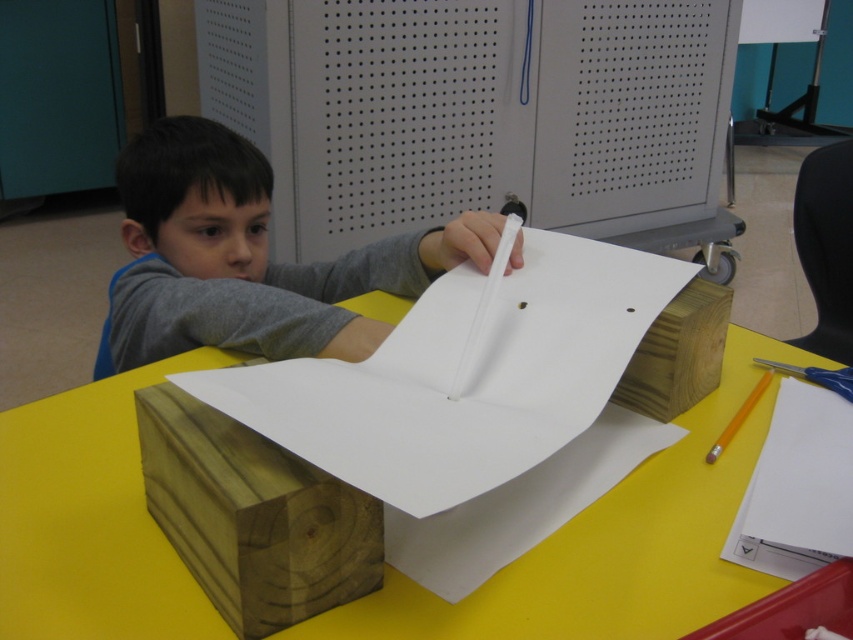
Which is behind, point (132, 237) or point (764, 385)?

Point (132, 237)

The width and height of the screenshot is (853, 640). I want to click on gray matte shirt at upper left, so click(247, 259).

Is point (247, 144) less distant than point (709, 452)?

That is False.

Identify the location of gray matte shirt at upper left. This screenshot has width=853, height=640. (247, 259).

Which of these two, gray perforated locker at upper center or yellow matte pencil at center, stands shorter?

Standing shorter between the two is yellow matte pencil at center.

Between gray perforated locker at upper center and yellow matte pencil at center, which one has more height?

Standing taller between the two is gray perforated locker at upper center.

This screenshot has height=640, width=853. Find the location of `gray perforated locker at upper center`. gray perforated locker at upper center is located at coordinates (480, 115).

Does yellow matte table at center have a larger size compared to yellow matte pencil at center?

Correct, yellow matte table at center is larger in size than yellow matte pencil at center.

How distant is yellow matte table at center from yellow matte pencil at center?

They are 10.09 inches apart.

You are a GUI agent. You are given a task and a screenshot of the screen. Output one action in this format:
    pyautogui.click(x=<x>, y=<y>)
    Task: Click on the yellow matte table at center
    The width and height of the screenshot is (853, 640).
    Given the screenshot: What is the action you would take?
    pyautogui.click(x=611, y=545)